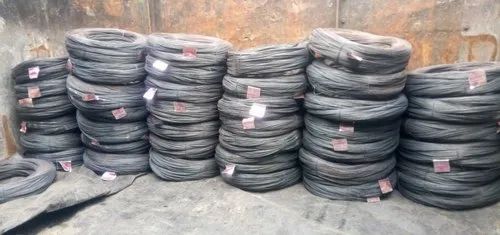
The image size is (500, 235). What are the coordinates of `wall in background` in the screenshot? It's located at (253, 20).